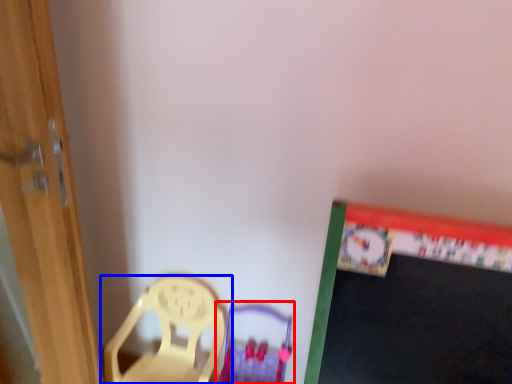
Question: Which object appears farthest to the camera in this image, armchair (highlighted by a red box) or chair (highlighted by a blue box)?

Choices:
 (A) armchair
 (B) chair

Answer: (B)